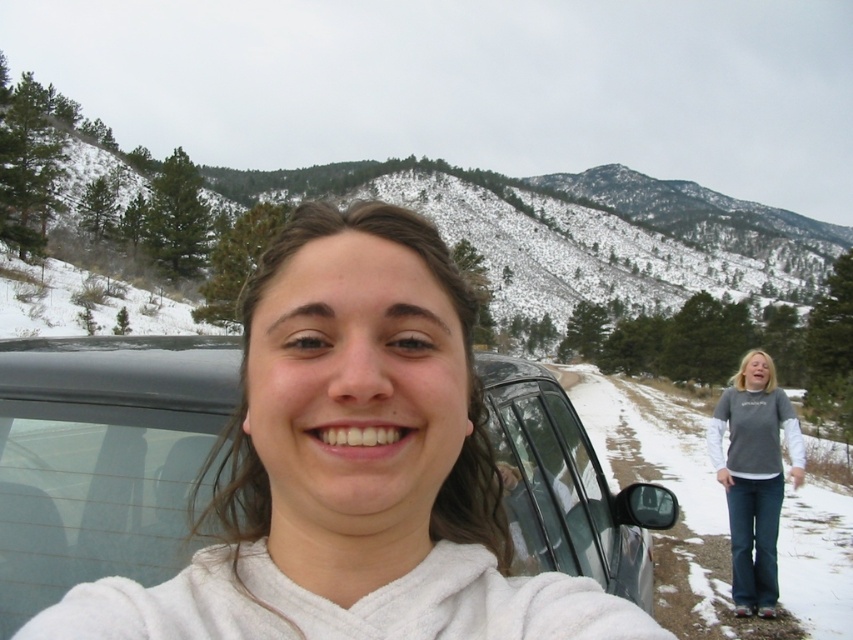
Is metallic gray car at center to the left of gray cotton shirt at lower right from the viewer's perspective?

Indeed, metallic gray car at center is positioned on the left side of gray cotton shirt at lower right.

Between point (509, 470) and point (773, 465), which one is positioned in front?

Positioned in front is point (509, 470).

Identify the location of metallic gray car at center. (102, 458).

What do you see at coordinates (552, 230) in the screenshot? I see `snowy forested mountain at upper center` at bounding box center [552, 230].

Who is more distant from viewer, (x=447, y=163) or (x=498, y=460)?

The point (x=447, y=163) is behind.

You are a GUI agent. You are given a task and a screenshot of the screen. Output one action in this format:
    pyautogui.click(x=<x>, y=<y>)
    Task: Click on the snowy forested mountain at upper center
    Image resolution: width=853 pixels, height=640 pixels.
    Given the screenshot: What is the action you would take?
    pyautogui.click(x=552, y=230)

This screenshot has width=853, height=640. Identify the location of snowy forested mountain at upper center. (552, 230).

Is point (376, 179) closer to camera compared to point (778, 432)?

No, it is behind (778, 432).

Can you confirm if snowy forested mountain at upper center is positioned to the left of gray cotton shirt at lower right?

Incorrect, snowy forested mountain at upper center is not on the left side of gray cotton shirt at lower right.

Locate an element on the screen. The height and width of the screenshot is (640, 853). snowy forested mountain at upper center is located at coordinates (552, 230).